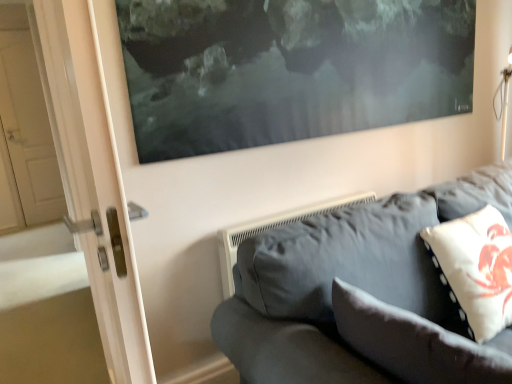
Question: Can you confirm if white fabric pillow at lower right, marked as the first pillow in a left-to-right arrangement, is shorter than white dotted fabric pillow at right, the 1th pillow in the right-to-left sequence?

Choices:
 (A) no
 (B) yes

Answer: (B)

Question: From a real-world perspective, is white fabric pillow at lower right, which ranks as the 2th pillow in right-to-left order, below white dotted fabric pillow at right, marked as the 2th pillow in a left-to-right arrangement?

Choices:
 (A) no
 (B) yes

Answer: (B)

Question: Does white fabric pillow at lower right, which ranks as the 2th pillow in right-to-left order, appear on the left side of white dotted fabric pillow at right, marked as the 2th pillow in a left-to-right arrangement?

Choices:
 (A) no
 (B) yes

Answer: (B)

Question: Can you confirm if white fabric pillow at lower right, which ranks as the 2th pillow in right-to-left order, is positioned to the right of white dotted fabric pillow at right, marked as the 2th pillow in a left-to-right arrangement?

Choices:
 (A) no
 (B) yes

Answer: (A)

Question: Is white dotted fabric pillow at right, the 1th pillow in the right-to-left sequence, a part of white fabric pillow at lower right, which ranks as the 2th pillow in right-to-left order?

Choices:
 (A) yes
 (B) no

Answer: (B)

Question: Does white fabric pillow at lower right, marked as the first pillow in a left-to-right arrangement, have a smaller size compared to white dotted fabric pillow at right, the 1th pillow in the right-to-left sequence?

Choices:
 (A) yes
 (B) no

Answer: (A)

Question: From the image's perspective, is white dotted fabric pillow at right, the 1th pillow in the right-to-left sequence, beneath white fabric pillow at lower right, marked as the first pillow in a left-to-right arrangement?

Choices:
 (A) no
 (B) yes

Answer: (A)

Question: Is white dotted fabric pillow at right, the 1th pillow in the right-to-left sequence, positioned far away from white fabric pillow at lower right, which ranks as the 2th pillow in right-to-left order?

Choices:
 (A) no
 (B) yes

Answer: (A)

Question: Is white dotted fabric pillow at right, marked as the 2th pillow in a left-to-right arrangement, shorter than white fabric pillow at lower right, marked as the first pillow in a left-to-right arrangement?

Choices:
 (A) yes
 (B) no

Answer: (B)

Question: Is white dotted fabric pillow at right, the 1th pillow in the right-to-left sequence, to the left of white fabric pillow at lower right, marked as the first pillow in a left-to-right arrangement, from the viewer's perspective?

Choices:
 (A) no
 (B) yes

Answer: (A)

Question: From a real-world perspective, is white dotted fabric pillow at right, the 1th pillow in the right-to-left sequence, beneath white fabric pillow at lower right, marked as the first pillow in a left-to-right arrangement?

Choices:
 (A) no
 (B) yes

Answer: (A)

Question: Is white dotted fabric pillow at right, marked as the 2th pillow in a left-to-right arrangement, turned away from white fabric pillow at lower right, which ranks as the 2th pillow in right-to-left order?

Choices:
 (A) yes
 (B) no

Answer: (B)

Question: Is white fabric pillow at lower right, which ranks as the 2th pillow in right-to-left order, further to camera compared to dark gray fabric couch at lower right?

Choices:
 (A) yes
 (B) no

Answer: (A)